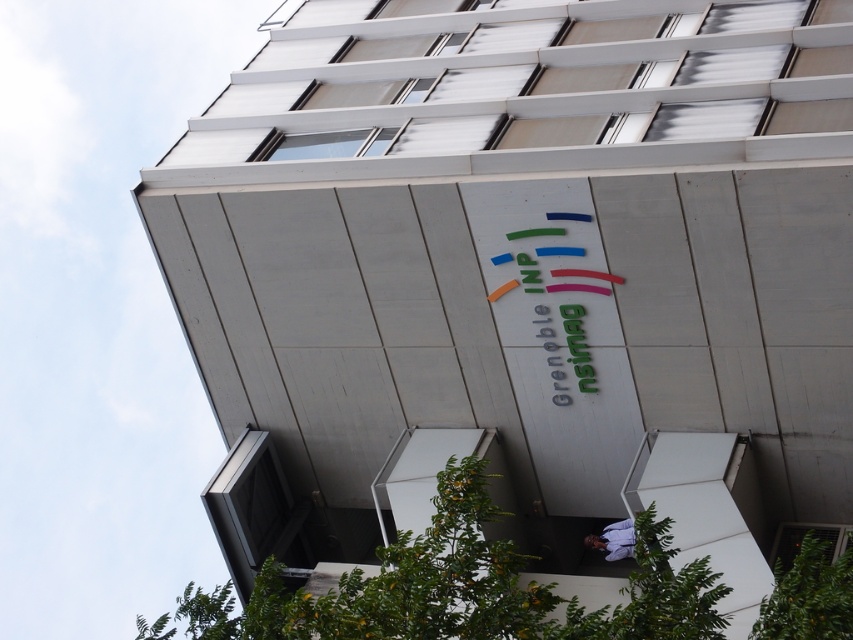
Question: Does glossy plastic sign at center appear on the left side of light blue shirt at lower center?

Choices:
 (A) no
 (B) yes

Answer: (B)

Question: Which of the following is the closest to the observer?

Choices:
 (A) (616, 541)
 (B) (576, 356)

Answer: (B)

Question: Which of the following is the farthest from the observer?

Choices:
 (A) light blue shirt at lower center
 (B) glossy plastic sign at center

Answer: (A)

Question: Can you confirm if glossy plastic sign at center is positioned above light blue shirt at lower center?

Choices:
 (A) no
 (B) yes

Answer: (B)

Question: Does glossy plastic sign at center appear on the left side of light blue shirt at lower center?

Choices:
 (A) no
 (B) yes

Answer: (B)